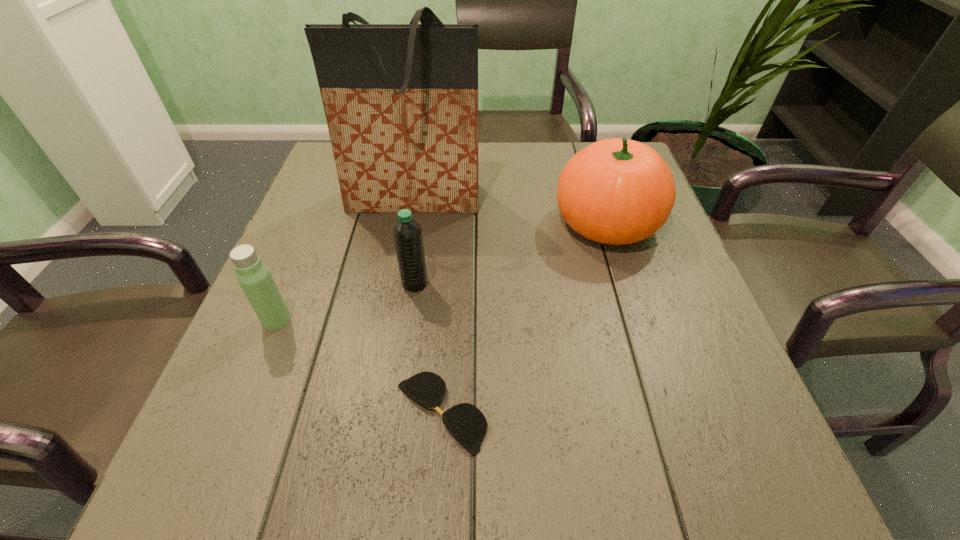
You are a GUI agent. You are given a task and a screenshot of the screen. Output one action in this format:
    pyautogui.click(x=<x>, y=<y>)
    Task: Click on the object that is positioned at the far right corner
    The width and height of the screenshot is (960, 540).
    Given the screenshot: What is the action you would take?
    pyautogui.click(x=616, y=191)

What are the coordinates of `free space at the far edge of the desktop` in the screenshot? It's located at (492, 159).

The width and height of the screenshot is (960, 540). I want to click on free space at the near edge of the desktop, so click(308, 492).

In the image, there is a desktop. Where is `vacant region at the left edge`? Image resolution: width=960 pixels, height=540 pixels. vacant region at the left edge is located at coordinates (294, 292).

I want to click on free space at the right edge of the desktop, so click(x=655, y=285).

This screenshot has width=960, height=540. Identify the location of vacant position at the near left corner of the desktop. (210, 464).

Locate an element on the screen. vacant area that lies between the nearest object and the water bottle is located at coordinates [x=428, y=348].

Identify the location of empty location between the second nearest object and the shortest object. 359,366.

You are a GUI agent. You are given a task and a screenshot of the screen. Output one action in this format:
    pyautogui.click(x=<x>, y=<y>)
    Task: Click on the vacant area that lies between the pumpkin and the thermos bottle
    Image resolution: width=960 pixels, height=540 pixels.
    Given the screenshot: What is the action you would take?
    pyautogui.click(x=442, y=271)

Identify the location of unoccupied area between the pumpkin and the nearest object. Image resolution: width=960 pixels, height=540 pixels. (524, 318).